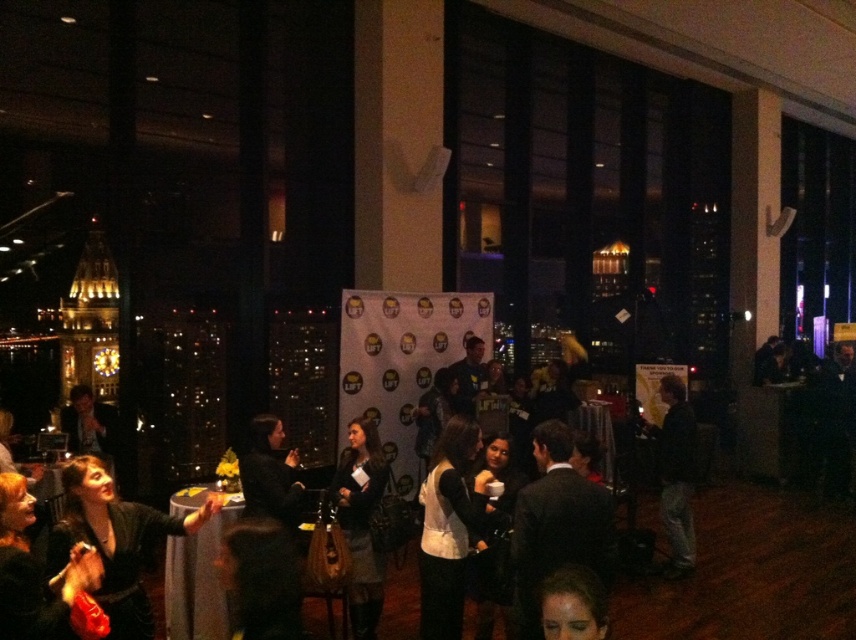
From the picture: Can you confirm if dark suit at center is wider than dark gray fabric dress at center?

Indeed, dark suit at center has a greater width compared to dark gray fabric dress at center.

What do you see at coordinates (556, 525) in the screenshot? I see `dark suit at center` at bounding box center [556, 525].

Is point (531, 627) less distant than point (382, 476)?

Yes, it is.

You are a GUI agent. You are given a task and a screenshot of the screen. Output one action in this format:
    pyautogui.click(x=<x>, y=<y>)
    Task: Click on the dark suit at center
    Image resolution: width=856 pixels, height=640 pixels.
    Given the screenshot: What is the action you would take?
    point(556,525)

Can you confirm if dark gray suit at center is taller than smooth skin face at center?

Yes, dark gray suit at center is taller than smooth skin face at center.

Between point (664, 454) and point (553, 586), which one is positioned in front?

Point (553, 586) is more forward.

Image resolution: width=856 pixels, height=640 pixels. Identify the location of dark gray suit at center. (675, 470).

Between point (137, 598) and point (675, 561), which one is positioned behind?

The point (675, 561) is more distant.

How far apart are velvet black dress at lower left and dark gray suit at center?

velvet black dress at lower left is 12.84 feet from dark gray suit at center.

Which is behind, point (88, 513) or point (682, 524)?

The point (682, 524) is more distant.

The width and height of the screenshot is (856, 640). Identify the location of velvet black dress at lower left. click(x=116, y=540).